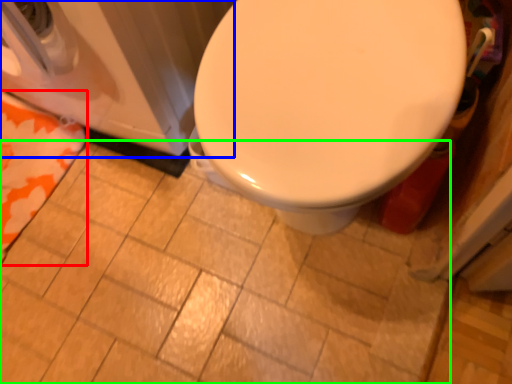
Question: Which object is the farthest from beach towel (highlighted by a red box)? Choose among these: washer (highlighted by a blue box) or ceramic tile (highlighted by a green box).

Choices:
 (A) washer
 (B) ceramic tile

Answer: (B)